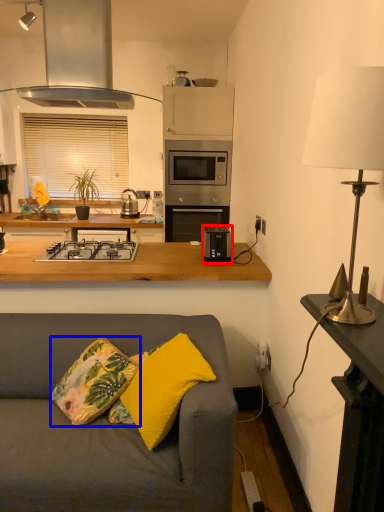
Question: Which object appears closest to the camera in this image, toaster (highlighted by a red box) or throw pillow (highlighted by a blue box)?

Choices:
 (A) toaster
 (B) throw pillow

Answer: (B)